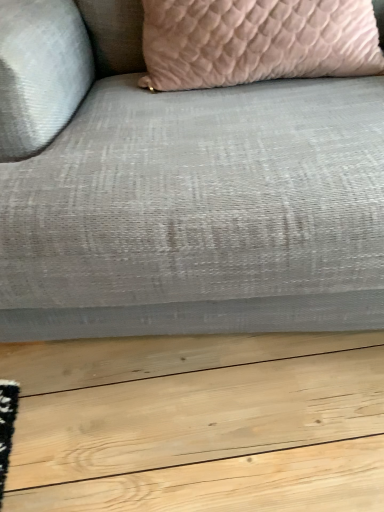
Question: Considering the relative sizes of textured gray fabric couch at center and pink textured pillow at upper center in the image provided, is textured gray fabric couch at center smaller than pink textured pillow at upper center?

Choices:
 (A) no
 (B) yes

Answer: (A)

Question: From a real-world perspective, is textured gray fabric couch at center below pink textured pillow at upper center?

Choices:
 (A) no
 (B) yes

Answer: (B)

Question: Considering the relative sizes of textured gray fabric couch at center and pink textured pillow at upper center in the image provided, is textured gray fabric couch at center bigger than pink textured pillow at upper center?

Choices:
 (A) yes
 (B) no

Answer: (A)

Question: Does textured gray fabric couch at center have a lesser width compared to pink textured pillow at upper center?

Choices:
 (A) no
 (B) yes

Answer: (A)

Question: From the image's perspective, does textured gray fabric couch at center appear lower than pink textured pillow at upper center?

Choices:
 (A) no
 (B) yes

Answer: (B)

Question: Is textured gray fabric couch at center not near pink textured pillow at upper center?

Choices:
 (A) yes
 (B) no

Answer: (B)

Question: From a real-world perspective, does pink textured pillow at upper center stand above textured gray fabric couch at center?

Choices:
 (A) yes
 (B) no

Answer: (A)

Question: Does pink textured pillow at upper center appear on the right side of textured gray fabric couch at center?

Choices:
 (A) no
 (B) yes

Answer: (B)

Question: Is textured gray fabric couch at center at the back of pink textured pillow at upper center?

Choices:
 (A) no
 (B) yes

Answer: (B)

Question: Is pink textured pillow at upper center wider than textured gray fabric couch at center?

Choices:
 (A) no
 (B) yes

Answer: (A)

Question: Could you tell me if pink textured pillow at upper center is turned towards textured gray fabric couch at center?

Choices:
 (A) yes
 (B) no

Answer: (A)

Question: Is pink textured pillow at upper center next to textured gray fabric couch at center?

Choices:
 (A) yes
 (B) no

Answer: (B)

Question: In the image, is textured gray fabric couch at center positioned in front of or behind pink textured pillow at upper center?

Choices:
 (A) front
 (B) behind

Answer: (A)